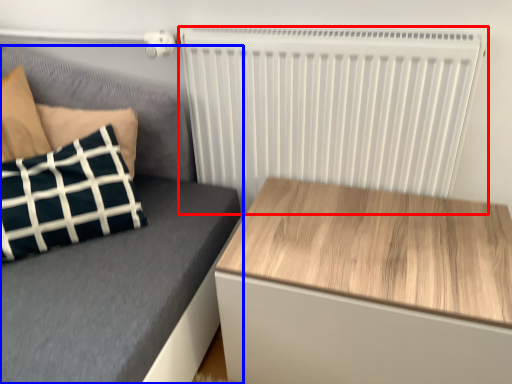
Question: Which of the following is the farthest to the observer, radiator (highlighted by a red box) or furniture (highlighted by a blue box)?

Choices:
 (A) radiator
 (B) furniture

Answer: (A)